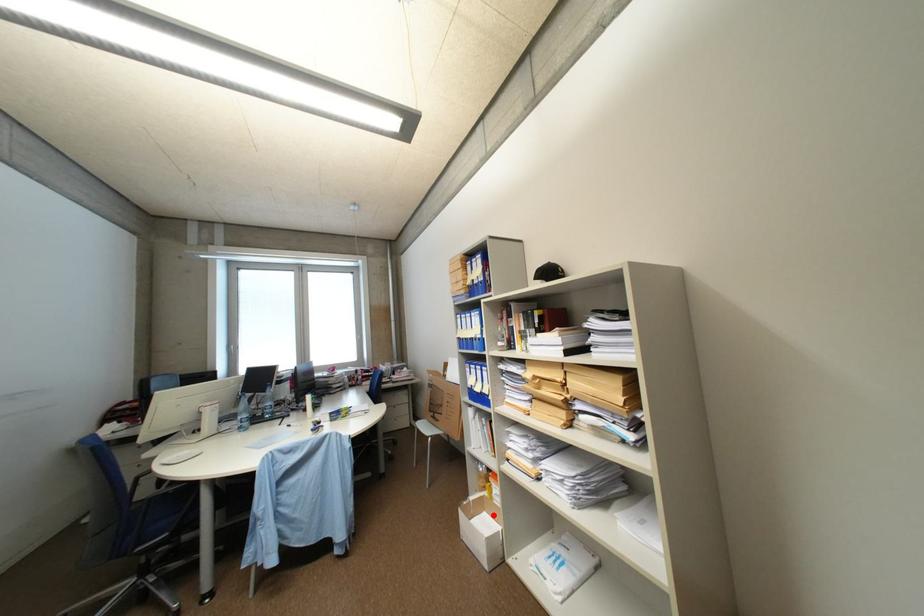
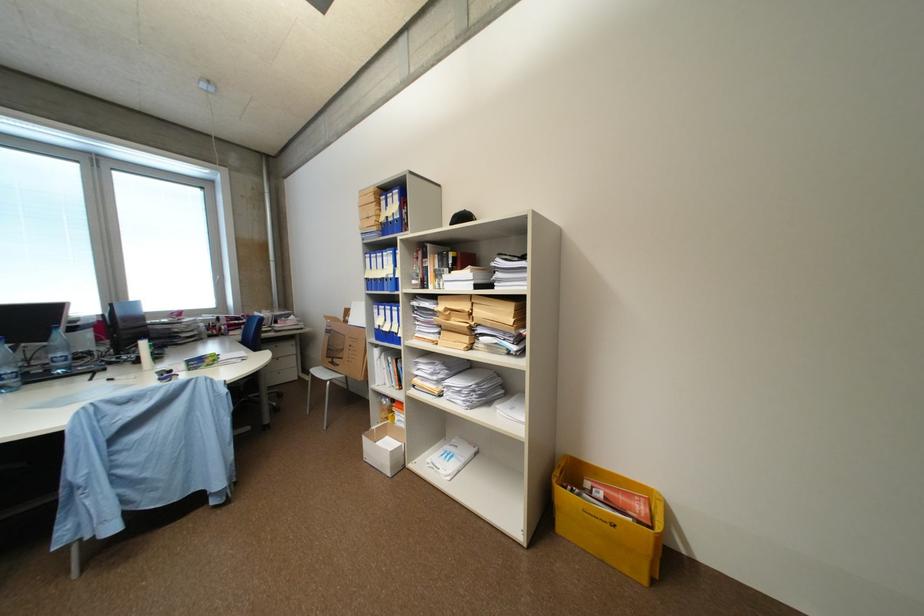
Question: I am providing you with two images of the same scene from different viewpoints. A red point is shown in image1. For the corresponding object point in image2, is it positioned nearer or farther from the camera?

Choices:
 (A) Nearer
 (B) Farther

Answer: (B)